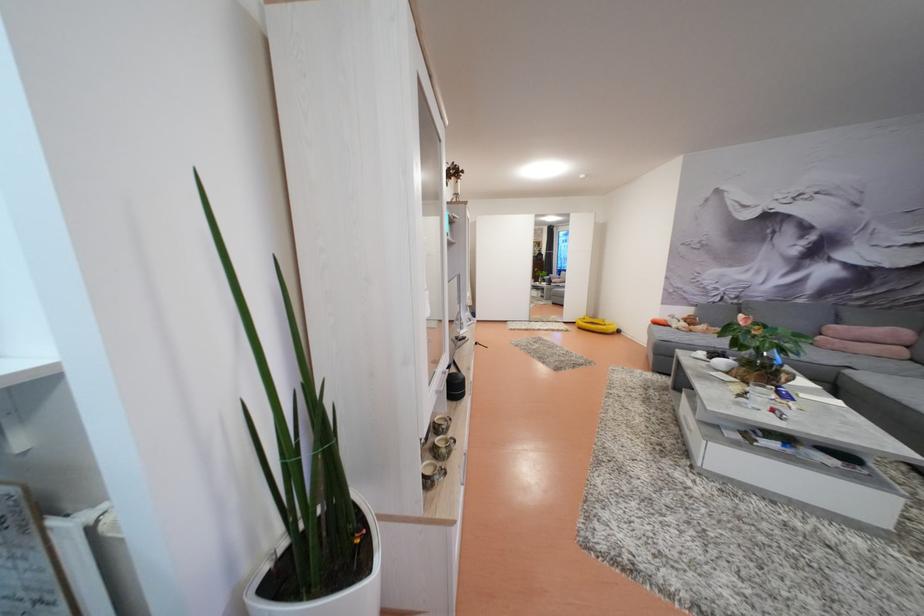
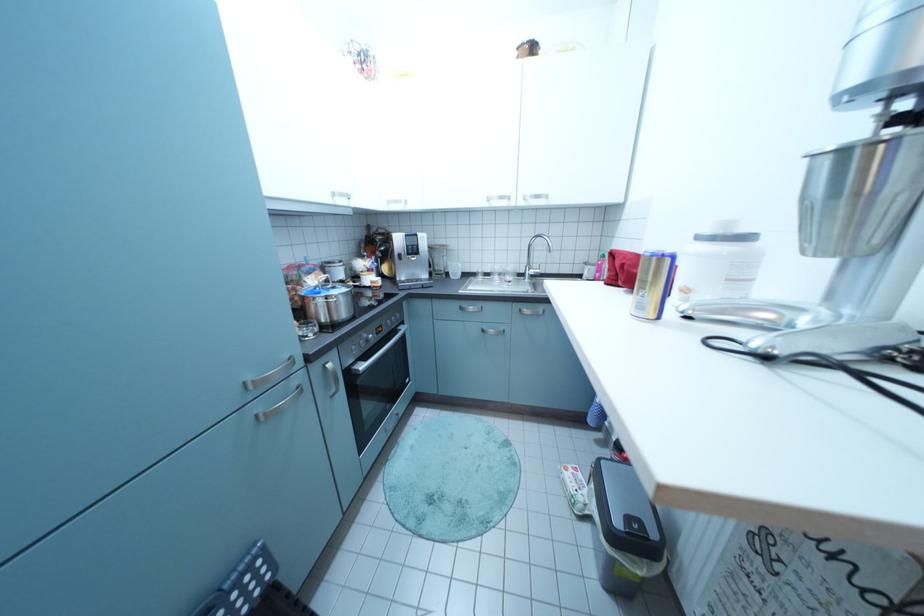
From the picture: The first image is from the beginning of the video and the second image is from the end. How did the camera likely rotate when shooting the video?

The camera rotated toward left-down.